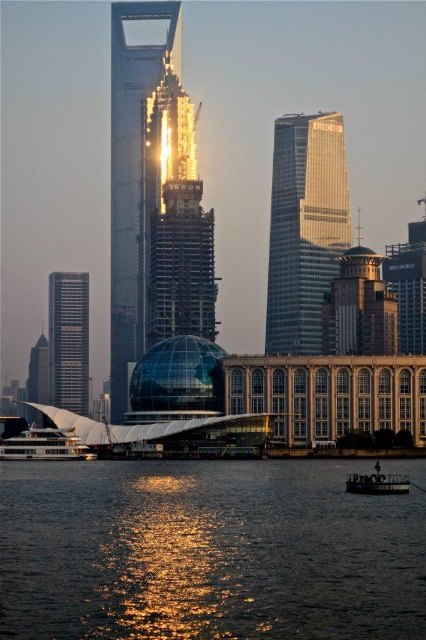
You are standing at the point marked by the coordinates point (207, 552) in the image. Based on the scene description, what would you most likely see around you?

You would most likely see glistening water at lower center around you, as the point (207, 552) corresponds to that location.

You are standing at the shore of the river in the image. There is a point marked at coordinates (207,552) which is glistening water at lower center. Can you see the modern glass dome structure from that point?

The point marked at (207,552) is glistening water at lower center. Since the modern glass dome structure is in the midground and the water is in the foreground, the water would block the view of the modern glass dome structure from that point.

You are standing on the riverbank and notice a point marked at coordinates (x=141, y=166) in the scene. What does this point indicate?

The point at coordinates (x=141, y=166) marks the location of the transparent glass dome at center.